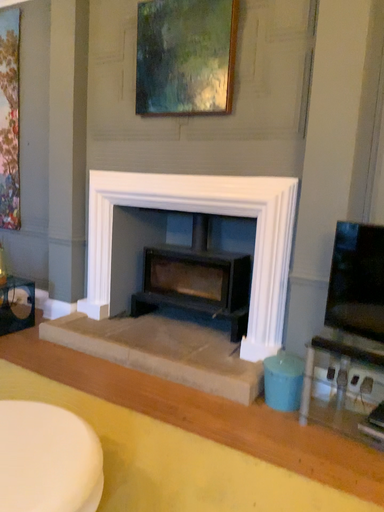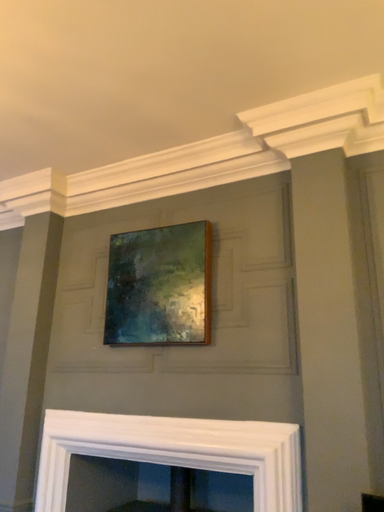
Question: How did the camera likely rotate when shooting the video?

Choices:
 (A) rotated downward
 (B) rotated upward

Answer: (B)